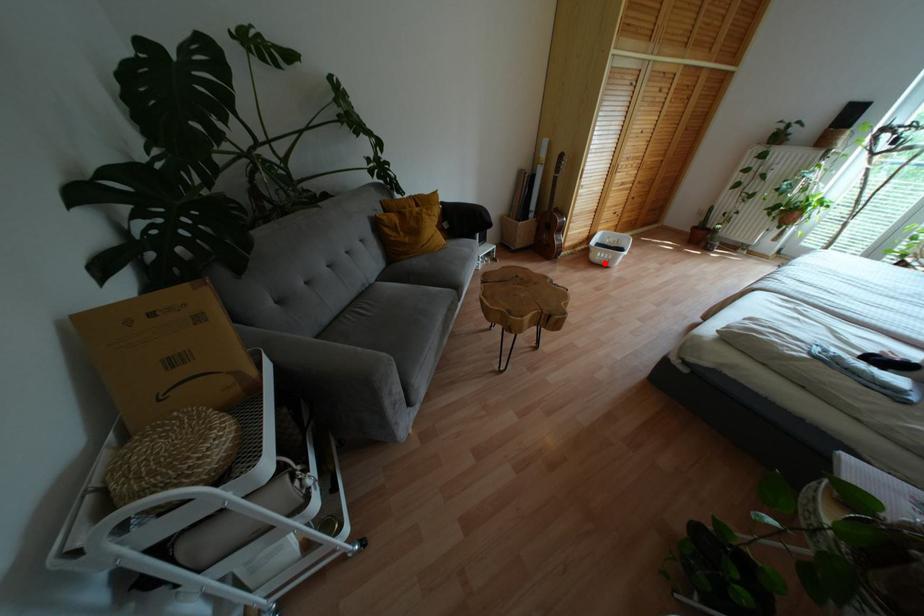
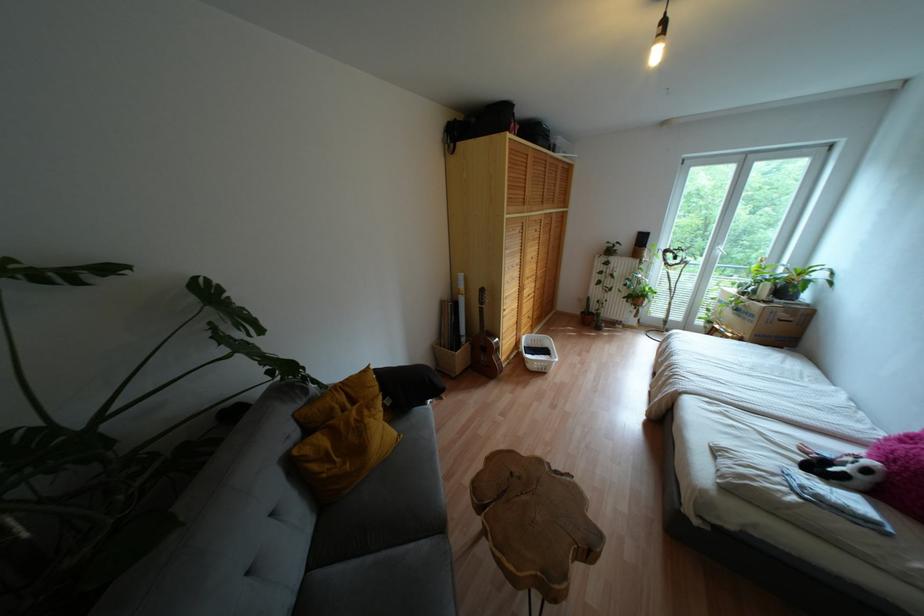
Question: I am providing you with two images of the same scene from different viewpoints. A red point is shown in image1. For the corresponding object point in image2, is it positioned nearer or farther from the camera?

Choices:
 (A) Nearer
 (B) Farther

Answer: (A)